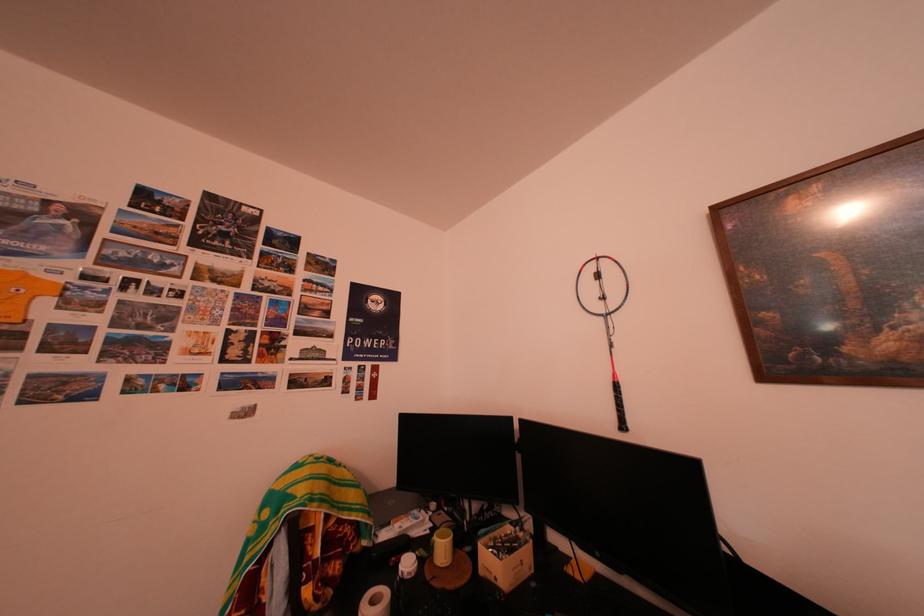
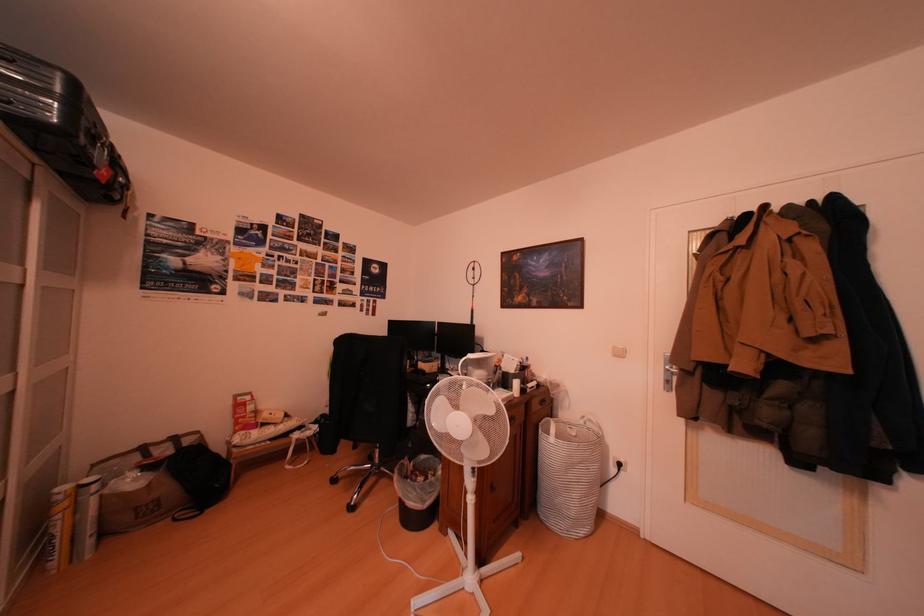
Question: Which direction would the cameraman need to move to produce the second image? Reply with the corresponding letter.

Choices:
 (A) Left
 (B) Right
 (C) Forward
 (D) Backward

Answer: (D)